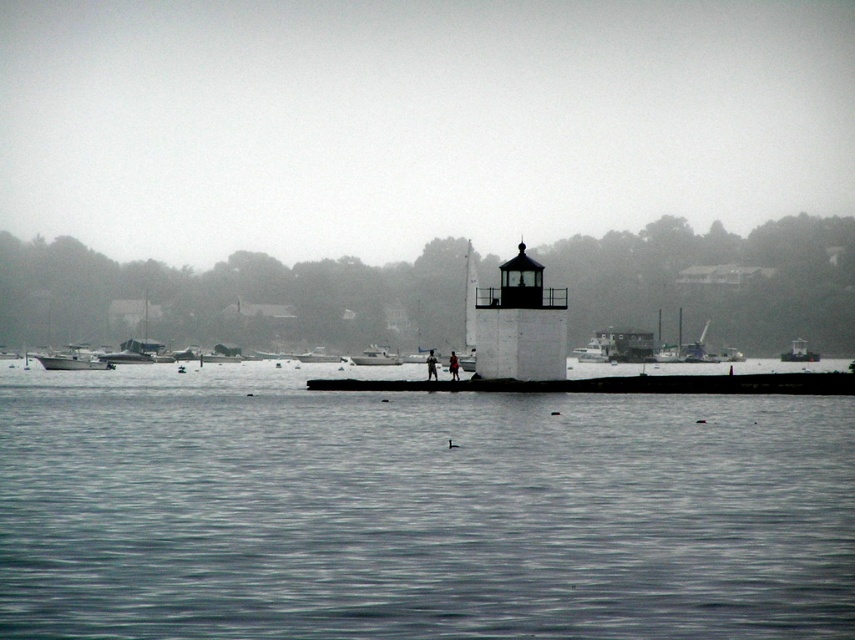
Question: Which of the following is the farthest from the observer?

Choices:
 (A) (44, 356)
 (B) (776, 509)
 (C) (677, 381)
 (D) (508, 368)

Answer: (A)

Question: Does smooth water at center appear over white plastic boat at center?

Choices:
 (A) yes
 (B) no

Answer: (A)

Question: Is the position of smooth water at center more distant than that of white fiberglass boat at center?

Choices:
 (A) yes
 (B) no

Answer: (B)

Question: Considering the real-world distances, which object is closest to the white plastic boat at center?

Choices:
 (A) smooth water at center
 (B) white fiberglass boat at center
 (C) black matte/lightweight tower at center

Answer: (B)

Question: Which of the following is the farthest from the observer?

Choices:
 (A) black matte/lightweight tower at center
 (B) white matte boat at left
 (C) black matte dock at center

Answer: (B)

Question: Does black matte dock at center have a greater width compared to white matte boat at left?

Choices:
 (A) yes
 (B) no

Answer: (B)